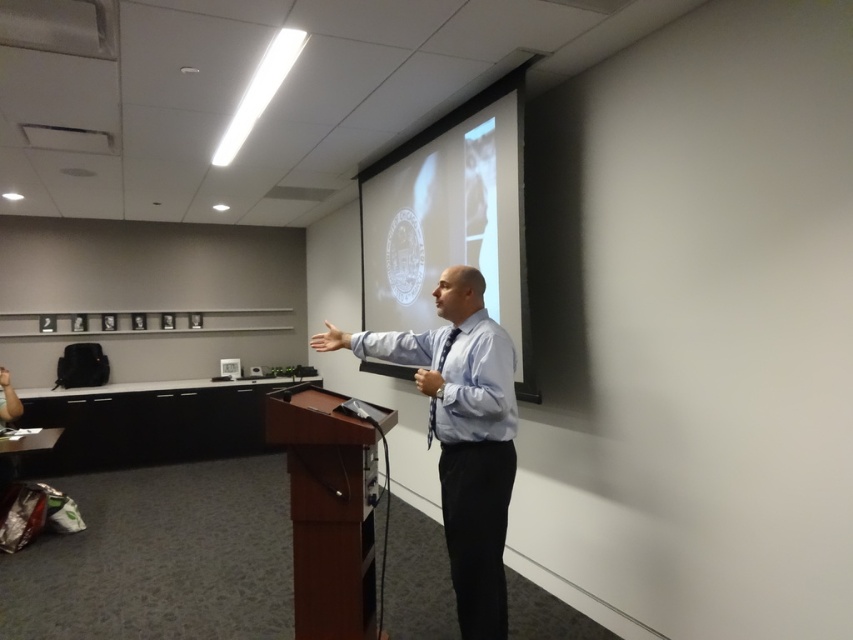
Question: Can you confirm if white glossy projection screen at upper center is positioned to the left of brown wood podium at center?

Choices:
 (A) no
 (B) yes

Answer: (A)

Question: Which object appears farthest from the camera in this image?

Choices:
 (A) blue shirt at center
 (B) brown wood podium at center

Answer: (B)

Question: Does blue shirt at center appear under brown wood podium at center?

Choices:
 (A) no
 (B) yes

Answer: (A)

Question: Can you confirm if white glossy projection screen at upper center is positioned to the left of brown wood podium at center?

Choices:
 (A) yes
 (B) no

Answer: (B)

Question: Estimate the real-world distances between objects in this image. Which object is closer to the brown wood podium at center?

Choices:
 (A) white glossy projection screen at upper center
 (B) blue shirt at center

Answer: (B)

Question: Considering the real-world distances, which object is farthest from the white glossy projection screen at upper center?

Choices:
 (A) brown wood podium at center
 (B) blue shirt at center

Answer: (A)